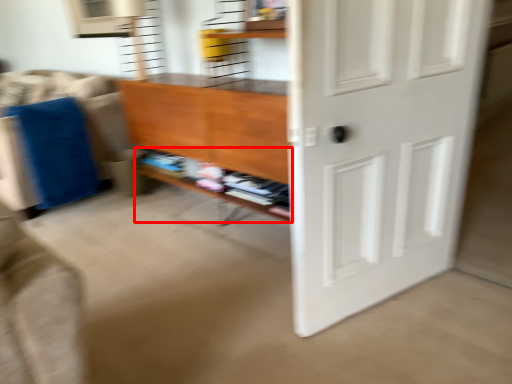
Question: From the image's perspective, where is shelf (annotated by the red box) located relative to door?

Choices:
 (A) above
 (B) below

Answer: (A)